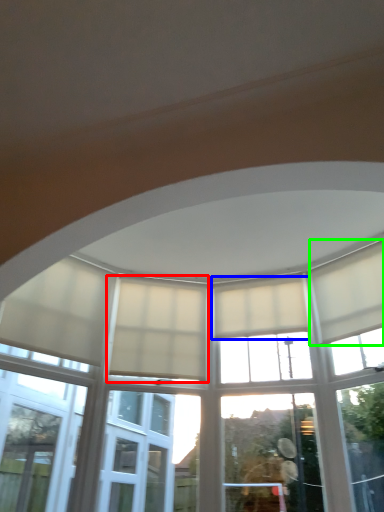
Question: Based on their relative distances, which object is nearer to curtain (highlighted by a red box)? Choose from curtain (highlighted by a blue box) and curtain (highlighted by a green box).

Choices:
 (A) curtain
 (B) curtain

Answer: (A)